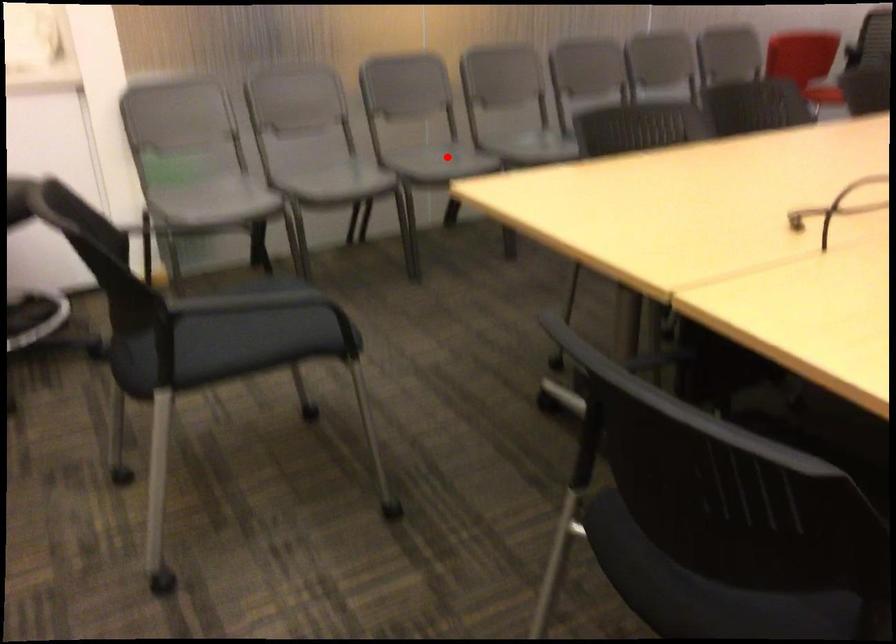
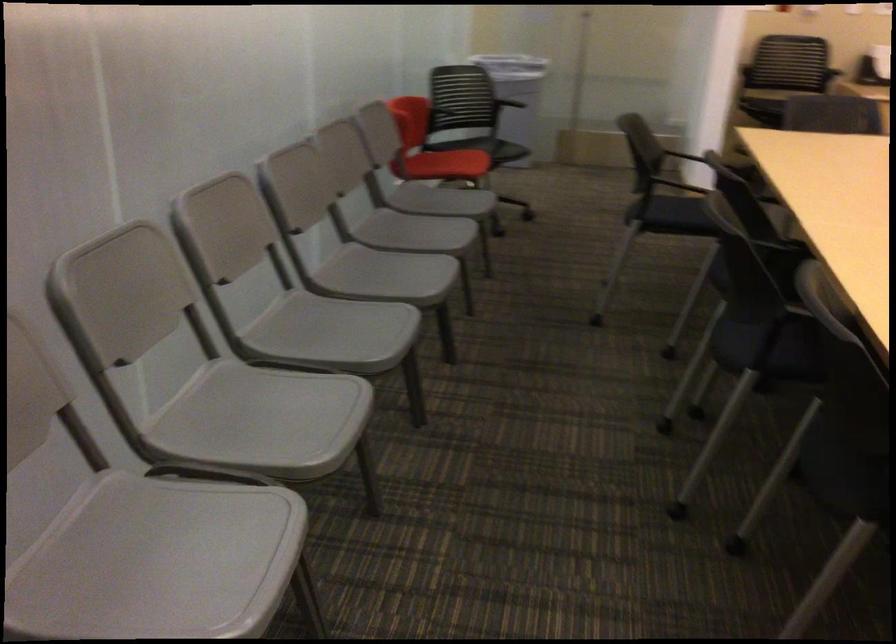
Question: I am providing you with two images of the same scene from different viewpoints. A red point is shown in image1. For the corresponding object point in image2, is it positioned nearer or farther from the camera?

Choices:
 (A) Nearer
 (B) Farther

Answer: (A)